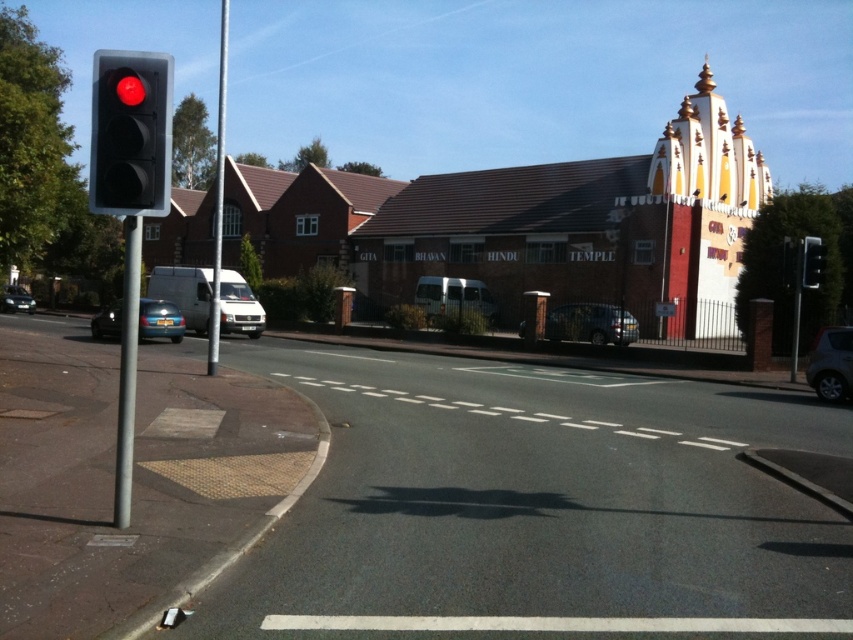
You are driving a car and need to park near the GITA BHAVAN HINDU TEMPLE. You see a metallic pole at left and a metallic silver car at left. Which object is closer to you as you approach the temple?

The metallic pole at left is closer to the viewer than the metallic silver car at left, so the pole would be nearer as you approach the temple.

You are a pedestrian standing at the crosswalk and want to cross the street. You see the black asphalt road at center and the metallic silver car at center. Which object is closer to the ground?

The black asphalt road at center is located below metallic silver car at center, so the black asphalt road at center is closer to the ground.